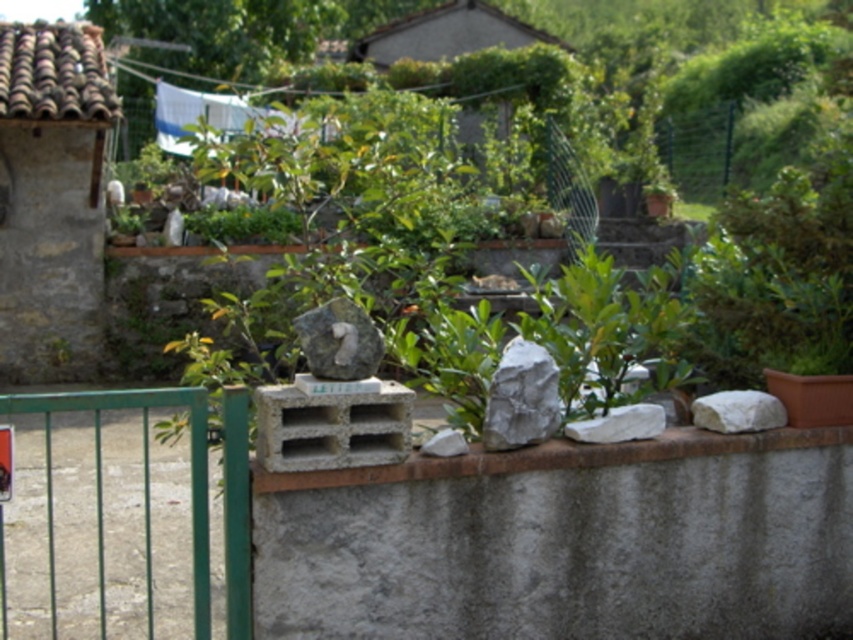
Does point (231, 497) come behind point (657, 417)?

No, (231, 497) is in front of (657, 417).

Is green metal gate at left below white smooth rock at center?

Yes.

Image resolution: width=853 pixels, height=640 pixels. Find the location of `green metal gate at left`. green metal gate at left is located at coordinates (190, 460).

Is gray concrete crate at center below gray stone at center?

Correct, gray concrete crate at center is located below gray stone at center.

Is gray concrete crate at center behind gray stone at center?

No, it is not.

The height and width of the screenshot is (640, 853). What do you see at coordinates (331, 428) in the screenshot?
I see `gray concrete crate at center` at bounding box center [331, 428].

What are the coordinates of `gray concrete crate at center` in the screenshot? It's located at (331, 428).

Is gray stone at center in front of white matte rock at center?

Yes, gray stone at center is in front of white matte rock at center.

From the picture: Does gray stone at center have a greater height compared to white matte rock at center?

Indeed, gray stone at center has a greater height compared to white matte rock at center.

Does point (364, 330) lie in front of point (457, 438)?

Yes, it is.

This screenshot has height=640, width=853. Find the location of `gray stone at center`. gray stone at center is located at coordinates (339, 340).